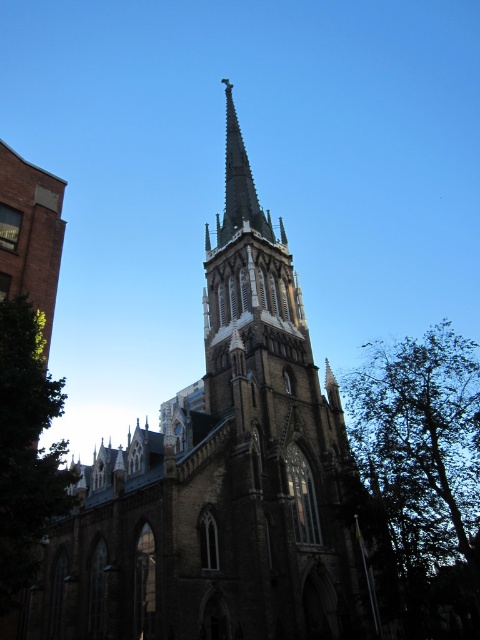
You are standing in front of the Gothic church and notice two green leafy trees. Which tree, the green leafy tree at right or the green leafy tree at lower left, is located more to the right side of the scene?

The green leafy tree at right is positioned on the right side of the green leafy tree at lower left, so it is located more to the right side of the scene.

You are a photographer planning to capture the stone church steeple at center and the green leafy tree at right in a single shot. Which object will appear taller in the photograph?

The stone church steeple at center will appear taller in the photograph because it has a greater height compared to the green leafy tree at right.

You are standing in front of the grand Gothic church and notice two points marked on the church facade. The first point is located at coordinates point (175, 484), and the second point is at point (468, 616). From your perspective, which point appears closer to you?

Point (175, 484) is in front of point (468, 616), so it appears closer to you.